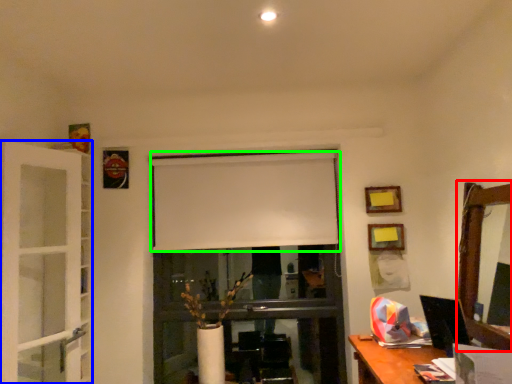
Question: Considering the real-world distances, which object is closest to mirror (highlighted by a red box)? screen door (highlighted by a blue box) or curtain (highlighted by a green box).

Choices:
 (A) screen door
 (B) curtain

Answer: (B)